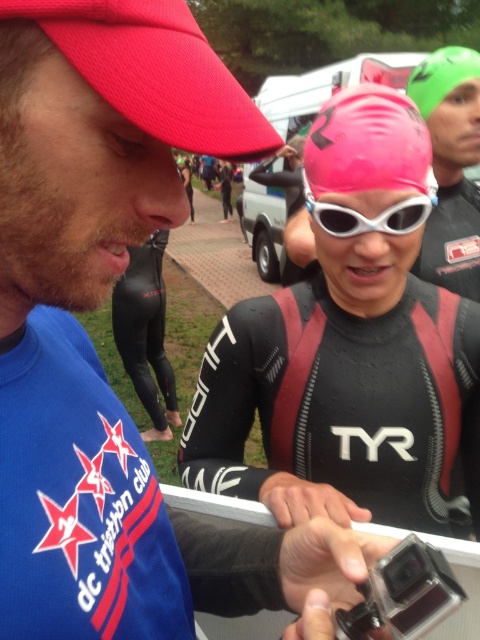
From the picture: Does pink matte swim cap at center appear on the left side of green matte swim cap at upper right?

Indeed, pink matte swim cap at center is positioned on the left side of green matte swim cap at upper right.

Is pink matte swim cap at center shorter than green matte swim cap at upper right?

Yes.

Between point (383, 120) and point (418, 67), which one is positioned behind?

The point (418, 67) is behind.

You are a GUI agent. You are given a task and a screenshot of the screen. Output one action in this format:
    pyautogui.click(x=<x>, y=<y>)
    Task: Click on the pink matte swim cap at center
    
    Given the screenshot: What is the action you would take?
    pyautogui.click(x=368, y=144)

Can you confirm if matte red baseball cap at upper left is taller than green matte swim cap at upper right?

Incorrect, matte red baseball cap at upper left's height is not larger of green matte swim cap at upper right's.

Which is below, matte red baseball cap at upper left or green matte swim cap at upper right?

matte red baseball cap at upper left is below.

Who is more forward, [61,26] or [422,88]?

Point [61,26]

Locate an element on the screen. matte red baseball cap at upper left is located at coordinates (155, 72).

What do you see at coordinates (368, 144) in the screenshot? I see `pink matte swim cap at center` at bounding box center [368, 144].

Is point (376, 163) positioned behind point (411, 214)?

That is False.

Where is `pink matte swim cap at center`? pink matte swim cap at center is located at coordinates (368, 144).